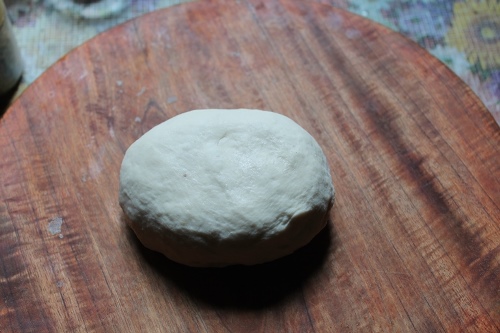
Find the location of a particular element. wooden dough board is located at coordinates (403, 194), (225, 56), (69, 202), (306, 316).